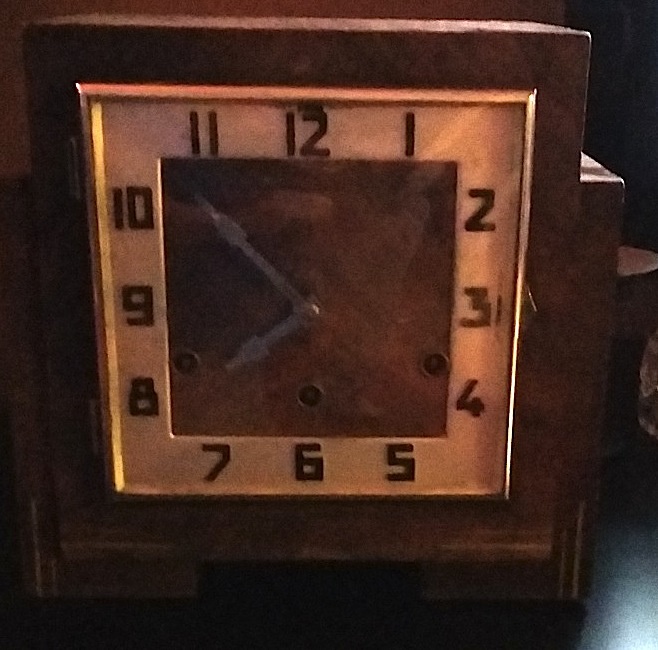
At what (x,y) coordinates should I click in order to perform the action: click on table. Please return your answer as a coordinate pair (x, y). This screenshot has width=658, height=650. Looking at the image, I should click on (299, 616).